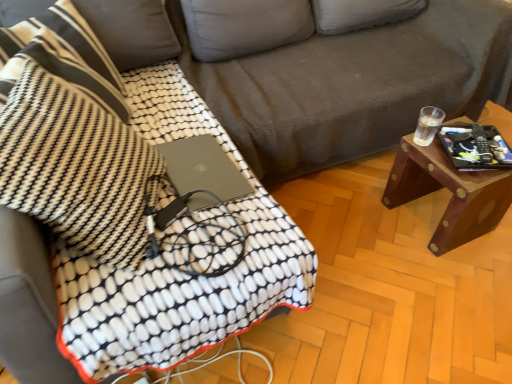
Question: Considering the relative positions of black textured throw pillow at left, positioned as the 1th throw pillow in front-to-back order, and black textured throw pillow at upper left, which ranks as the 2th throw pillow in front-to-back order, in the image provided, is black textured throw pillow at left, positioned as the 1th throw pillow in front-to-back order, to the right of black textured throw pillow at upper left, which ranks as the 2th throw pillow in front-to-back order, from the viewer's perspective?

Choices:
 (A) yes
 (B) no

Answer: (A)

Question: Considering the relative positions of black textured throw pillow at left, positioned as the 1th throw pillow in front-to-back order, and black textured throw pillow at upper left, which is the first throw pillow from back to front, in the image provided, is black textured throw pillow at left, positioned as the 1th throw pillow in front-to-back order, in front of black textured throw pillow at upper left, which is the first throw pillow from back to front,?

Choices:
 (A) yes
 (B) no

Answer: (A)

Question: From a real-world perspective, is black textured throw pillow at left, positioned as the 1th throw pillow in front-to-back order, beneath black textured throw pillow at upper left, which is the first throw pillow from back to front?

Choices:
 (A) yes
 (B) no

Answer: (B)

Question: Is black textured throw pillow at left, the 2th throw pillow from the back, further to camera compared to black textured throw pillow at upper left, which is the first throw pillow from back to front?

Choices:
 (A) no
 (B) yes

Answer: (A)

Question: From the image's perspective, is black textured throw pillow at left, positioned as the 1th throw pillow in front-to-back order, on black textured throw pillow at upper left, which is the first throw pillow from back to front?

Choices:
 (A) no
 (B) yes

Answer: (A)

Question: Considering the positions of black textured throw pillow at left, the 2th throw pillow from the back, and black textured throw pillow at upper left, which is the first throw pillow from back to front, in the image, is black textured throw pillow at left, the 2th throw pillow from the back, bigger or smaller than black textured throw pillow at upper left, which is the first throw pillow from back to front,?

Choices:
 (A) small
 (B) big

Answer: (B)

Question: From a real-world perspective, is black textured throw pillow at left, the 2th throw pillow from the back, positioned above or below black textured throw pillow at upper left, which ranks as the 2th throw pillow in front-to-back order?

Choices:
 (A) above
 (B) below

Answer: (A)

Question: Relative to black textured throw pillow at upper left, which ranks as the 2th throw pillow in front-to-back order, is black textured throw pillow at left, the 2th throw pillow from the back, in front or behind?

Choices:
 (A) behind
 (B) front

Answer: (B)

Question: Is point (132, 266) closer or farther from the camera than point (98, 41)?

Choices:
 (A) closer
 (B) farther

Answer: (A)

Question: Would you say matte black laptop at center is inside or outside white textured blanket at center?

Choices:
 (A) outside
 (B) inside

Answer: (B)

Question: In terms of height, does matte black laptop at center look taller or shorter compared to white textured blanket at center?

Choices:
 (A) short
 (B) tall

Answer: (A)

Question: Is matte black laptop at center wider or thinner than white textured blanket at center?

Choices:
 (A) thin
 (B) wide

Answer: (A)

Question: Considering the positions of matte black laptop at center and white textured blanket at center in the image, is matte black laptop at center bigger or smaller than white textured blanket at center?

Choices:
 (A) big
 (B) small

Answer: (B)

Question: Based on their sizes in the image, would you say woodenmaterial/texturetable at right is bigger or smaller than gray corduroy couch at center?

Choices:
 (A) big
 (B) small

Answer: (B)

Question: From a real-world perspective, is woodenmaterial/texturetable at right positioned above or below gray corduroy couch at center?

Choices:
 (A) above
 (B) below

Answer: (B)